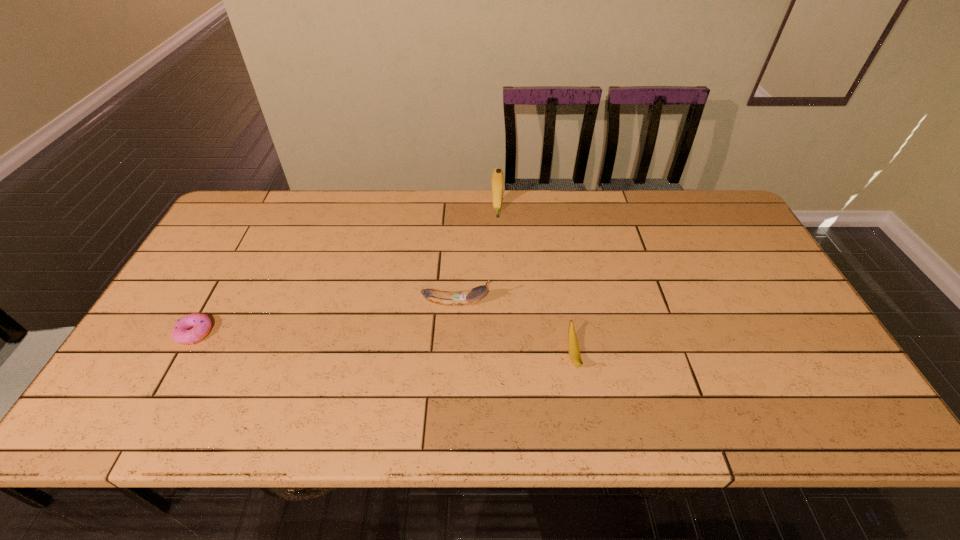
This screenshot has height=540, width=960. What are the coordinates of `object that is the closest to the farthest banana` in the screenshot? It's located at (473, 295).

Identify which object is located as the second nearest to the farthest object. Please provide its 2D coordinates. Your answer should be formatted as a tuple, i.e. [(x, y)], where the tuple contains the x and y coordinates of a point satisfying the conditions above.

[(573, 347)]

Where is `the closest banana to the nearest banana`? the closest banana to the nearest banana is located at coordinates (473, 295).

Choose which banana is the second nearest neighbor to the tallest banana. Please provide its 2D coordinates. Your answer should be formatted as a tuple, i.e. [(x, y)], where the tuple contains the x and y coordinates of a point satisfying the conditions above.

[(573, 347)]